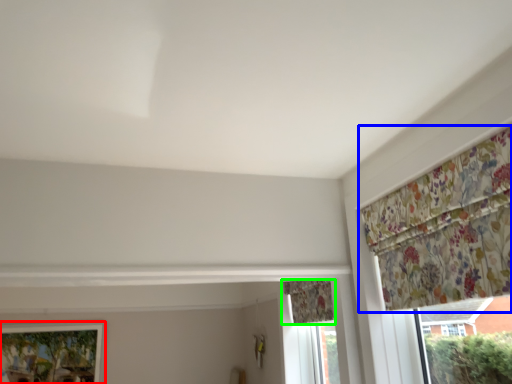
Question: Estimate the real-world distances between objects in this image. Which object is farther from window (highlighted by a red box), curtain (highlighted by a blue box) or curtain (highlighted by a green box)?

Choices:
 (A) curtain
 (B) curtain

Answer: (A)